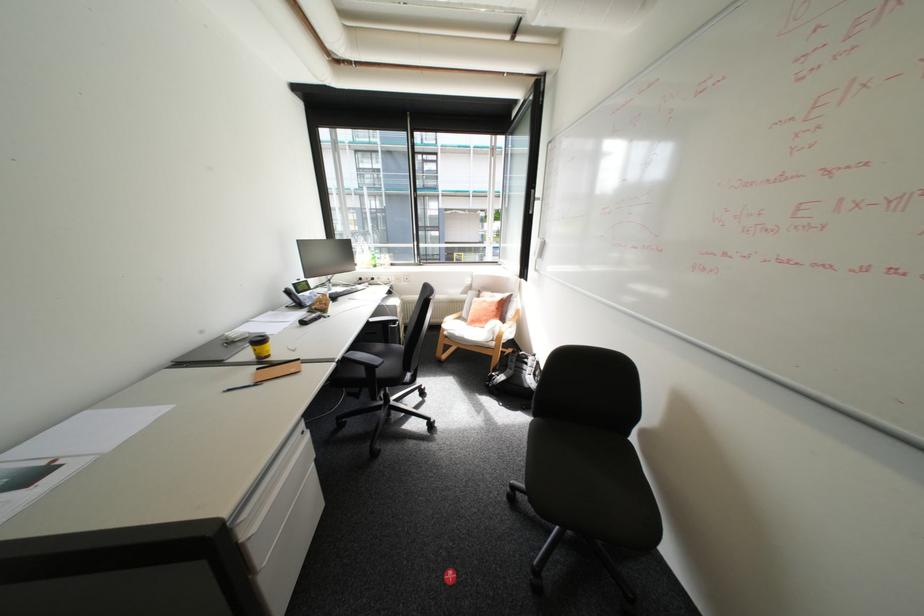
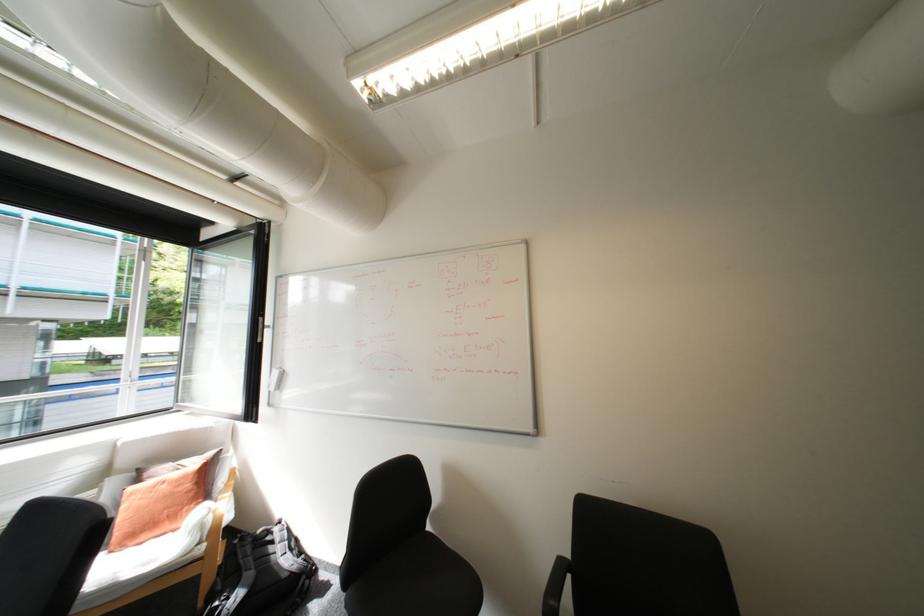
The point at (543, 254) is marked in the first image. Where is the corresponding point in the second image?

(277, 387)